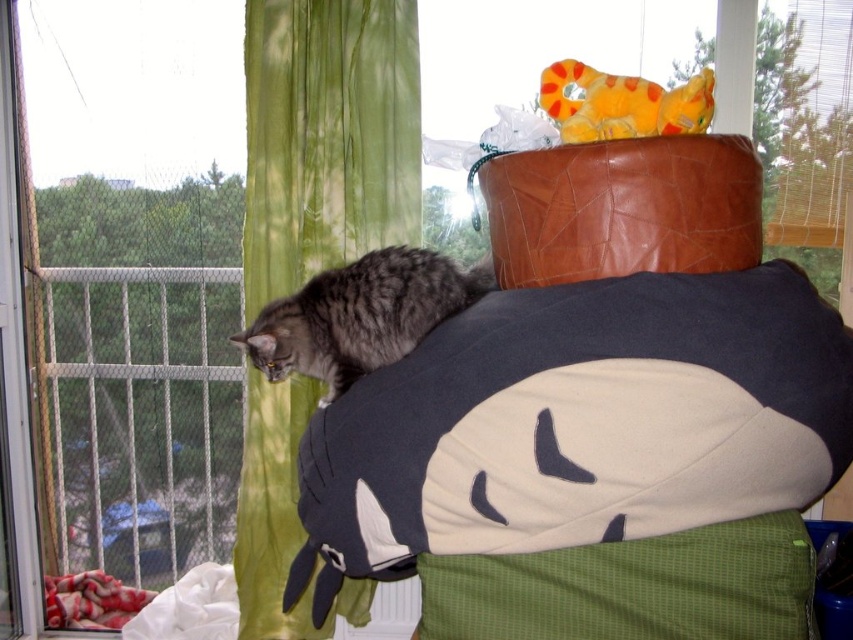
You are a cat sitting on the soft plush toy at upper right and want to jump to the metal mesh window at left. Which direction should you jump?

The metal mesh window at left is positioned on the left side of the soft plush toy at upper right, so you should jump to the left.

Based on the photo, you are standing in the room and want to place a small plant between the two points, point (256,51) and point (550,67). Which point should the plant be closer to so it is nearer to you?

The plant should be closer to point (256,51) because it is closer to the viewer than point (550,67).